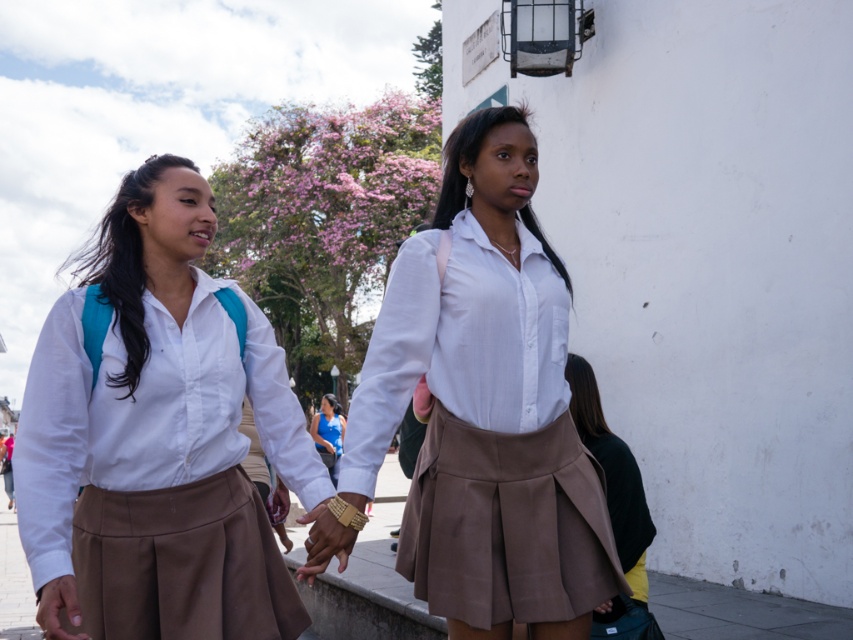
Question: Among these points, which one is farthest from the camera?

Choices:
 (A) (20, 492)
 (B) (393, 506)
 (C) (376, 412)

Answer: (B)

Question: Is matte white shirt at center positioned before blue fabric shirt at center?

Choices:
 (A) yes
 (B) no

Answer: (A)

Question: Does brown fabric pavement at lower center have a lesser width compared to blue fabric shirt at center?

Choices:
 (A) yes
 (B) no

Answer: (B)

Question: Which of the following is the farthest from the observer?

Choices:
 (A) brown fabric pavement at lower center
 (B) blue fabric shirt at center
 (C) matte white shirt at center
 (D) matte white blouse at center

Answer: (B)

Question: Which point is closer to the camera taking this photo?

Choices:
 (A) (337, 429)
 (B) (178, 588)

Answer: (B)

Question: Is brown fabric pavement at lower center positioned behind blue fabric shirt at center?

Choices:
 (A) yes
 (B) no

Answer: (B)